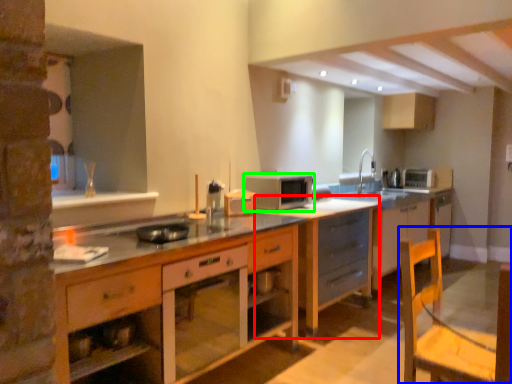
Question: Which object is positioned farthest from cabinetry (highlighted by a red box)? Select from swivel chair (highlighted by a blue box) and microwave oven (highlighted by a green box).

Choices:
 (A) swivel chair
 (B) microwave oven

Answer: (A)